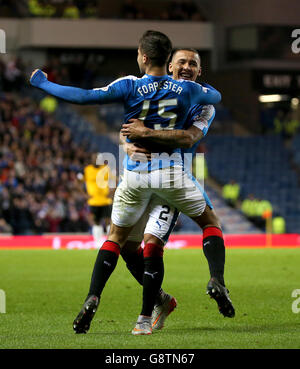
You are a GUI agent. You are given a task and a screenshot of the screen. Output one action in this format:
    pyautogui.click(x=<x>, y=<y>)
    Task: Click on the seats
    The image size is (300, 369).
    Given the screenshot: What is the action you would take?
    pyautogui.click(x=248, y=158)